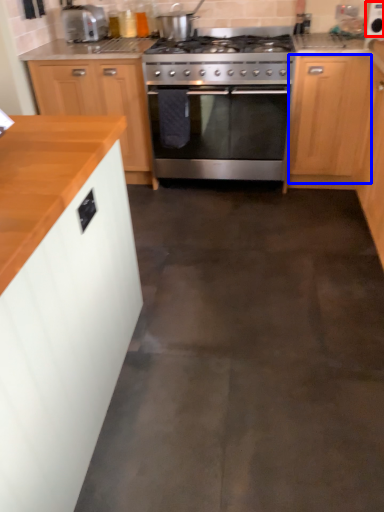
Question: Which object appears farthest to the camera in this image, appliance (highlighted by a red box) or cabinetry (highlighted by a blue box)?

Choices:
 (A) appliance
 (B) cabinetry

Answer: (A)